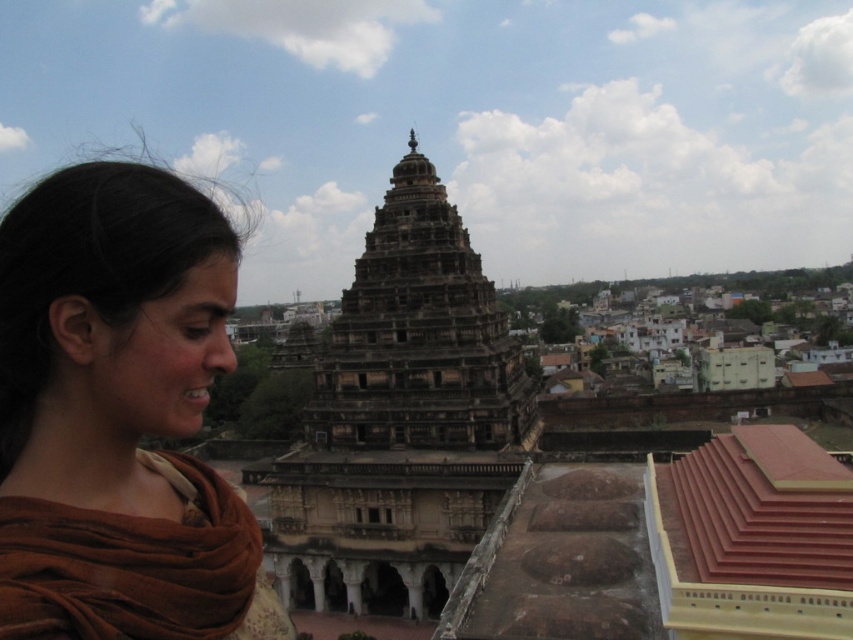
Question: Which point is farther from the camera taking this photo?

Choices:
 (A) (90, 314)
 (B) (508, 476)

Answer: (B)

Question: Does brown fabric at left lie behind dark brown stone tower at center?

Choices:
 (A) yes
 (B) no

Answer: (B)

Question: Which point is closer to the camera taking this photo?

Choices:
 (A) (358, 454)
 (B) (39, 628)

Answer: (B)

Question: Can you confirm if brown fabric at left is positioned to the right of dark brown stone tower at center?

Choices:
 (A) yes
 (B) no

Answer: (B)

Question: Is brown fabric at left to the right of dark brown stone tower at center from the viewer's perspective?

Choices:
 (A) no
 (B) yes

Answer: (A)